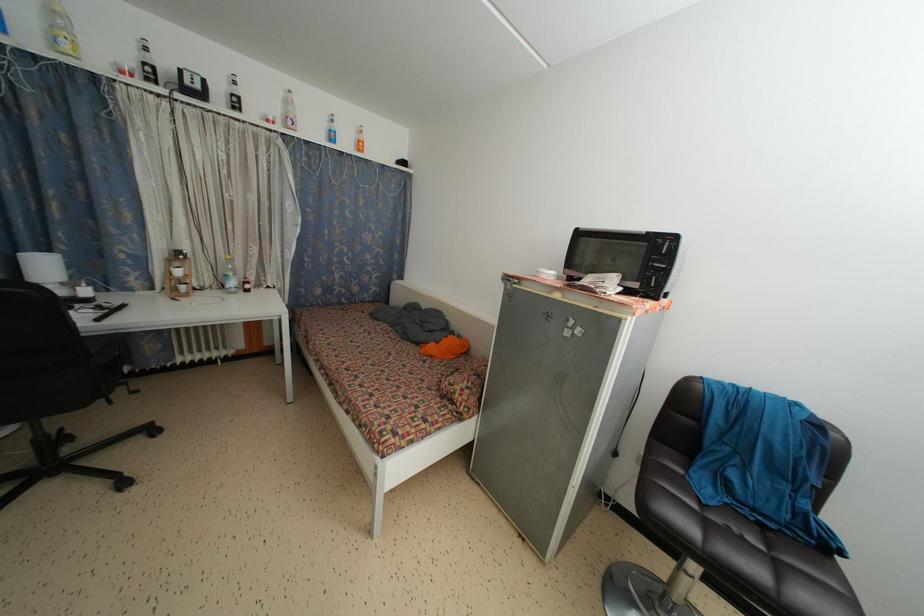
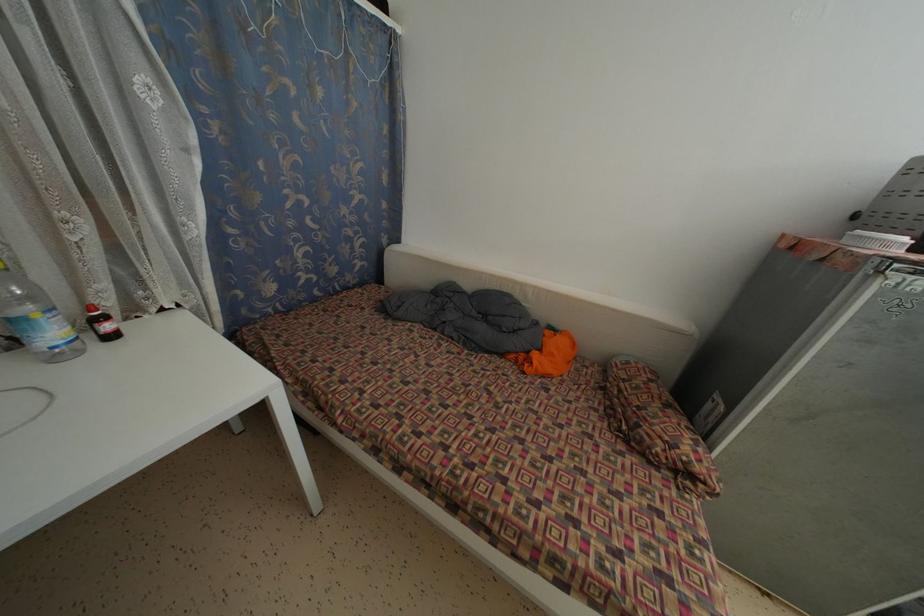
What movement of the cameraman would produce the second image?

The movement direction of the cameraman is left, forward.